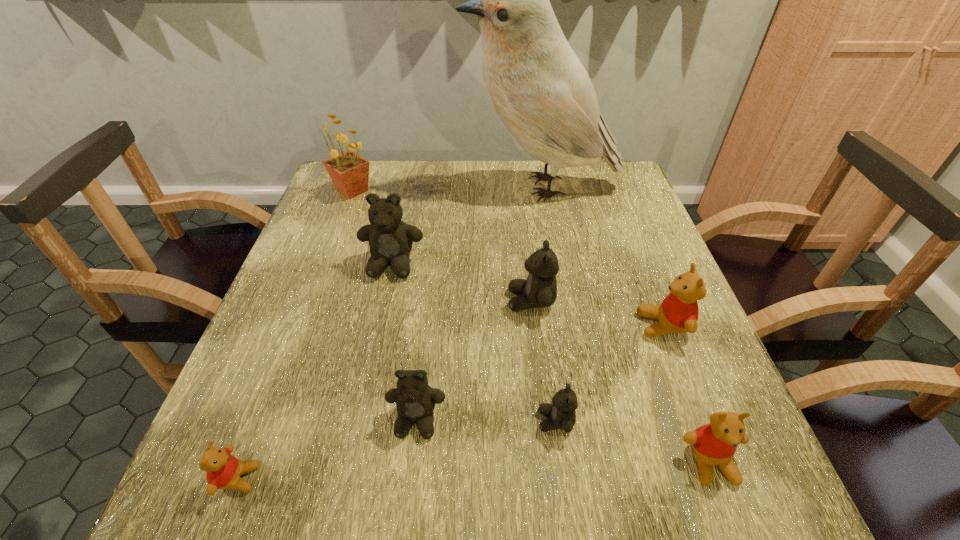
Where is `sunflower that is at the left edge`? The image size is (960, 540). sunflower that is at the left edge is located at coordinates (349, 172).

Image resolution: width=960 pixels, height=540 pixels. Find the location of `parakeet that is at the right edge`. parakeet that is at the right edge is located at coordinates (536, 84).

What are the coordinates of `object that is at the far left corner` in the screenshot? It's located at (349, 172).

Where is `object situated at the near left corner`? The image size is (960, 540). object situated at the near left corner is located at coordinates (224, 470).

Identify the location of object located at the far right corner. (536, 84).

Where is `object at the near right corner`? The image size is (960, 540). object at the near right corner is located at coordinates tap(715, 443).

In the image, there is a desktop. Identify the location of vacant space at the far edge. (548, 174).

The height and width of the screenshot is (540, 960). Identify the location of free space at the near edge of the desktop. (402, 497).

Image resolution: width=960 pixels, height=540 pixels. In the image, there is a desktop. Find the location of `vacant space at the left edge`. vacant space at the left edge is located at coordinates (347, 251).

The width and height of the screenshot is (960, 540). What are the coordinates of `free location at the right edge of the desktop` in the screenshot? It's located at (655, 285).